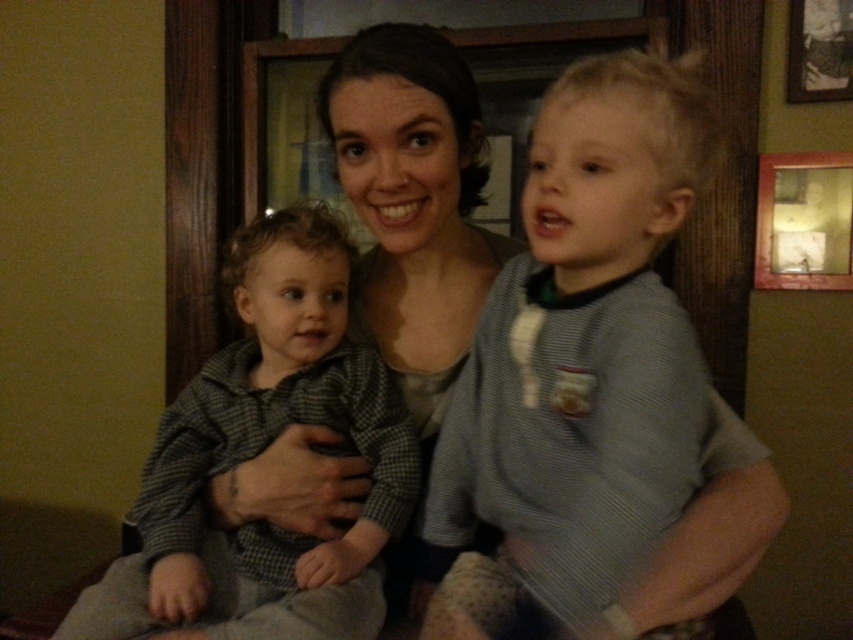
You are a photographer standing in front of the scene. You want to take a closeup photo of the gray striped shirt at right without moving the subject. Can you do it with a standard camera lens that has a minimum focusing distance of 26 inches?

The gray striped shirt at right is 25.90 inches away from the viewer. Since the minimum focusing distance of the standard camera lens is 26 inches, which is slightly longer than the distance to the subject, the photographer cannot focus on the gray striped shirt at right and capture a clear closeup photo without moving closer or using a different lens.

You are a photographer trying to capture a group photo of the gray striped shirt at right and the checkered fabric toddler at center. Based on their heights, which one should you position closer to the camera to ensure both are visible in the frame?

The gray striped shirt at right is taller than the checkered fabric toddler at center, so you should position the checkered fabric toddler at center closer to the camera to ensure both are visible in the frame.